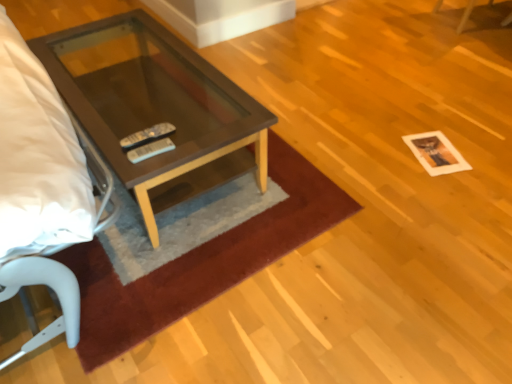
Measure the distance between point (234, 236) and camera.

The distance of point (234, 236) from camera is 1.70 meters.

What do you see at coordinates (436, 153) in the screenshot? This screenshot has height=384, width=512. I see `white paper at lower right` at bounding box center [436, 153].

Describe the element at coordinates (156, 108) in the screenshot. The width and height of the screenshot is (512, 384). I see `matte brown glass coffee table at center` at that location.

This screenshot has height=384, width=512. What are the coordinates of `brown plush rug at center` in the screenshot? It's located at [x=201, y=261].

Who is shorter, brown plush rug at center or matte brown glass coffee table at center?

With less height is brown plush rug at center.

From the picture: Could you tell me if brown plush rug at center is facing matte brown glass coffee table at center?

No.

From the image's perspective, which object appears higher, brown plush rug at center or matte brown glass coffee table at center?

matte brown glass coffee table at center, from the image's perspective.

Considering the relative sizes of brown plush rug at center and matte brown glass coffee table at center in the image provided, is brown plush rug at center bigger than matte brown glass coffee table at center?

No, brown plush rug at center is not bigger than matte brown glass coffee table at center.

Is brown plush rug at center located within white paper at lower right?

No, brown plush rug at center is not a part of white paper at lower right.

Are white paper at lower right and brown plush rug at center making contact?

No, white paper at lower right is not beside brown plush rug at center.

Does white paper at lower right have a greater width compared to brown plush rug at center?

No, white paper at lower right is not wider than brown plush rug at center.

Consider the image. Which of these two, white paper at lower right or brown plush rug at center, is smaller?

With smaller size is white paper at lower right.

Can you confirm if matte brown glass coffee table at center is taller than brown plush rug at center?

Yes.

Where is `mat in front of the matte brown glass coffee table at center`? This screenshot has height=384, width=512. mat in front of the matte brown glass coffee table at center is located at coordinates (201, 261).

Considering the points (165, 109) and (168, 311), which point is in front, point (165, 109) or point (168, 311)?

Point (168, 311)

Is matte brown glass coffee table at center inside or outside of white paper at lower right?

matte brown glass coffee table at center is not enclosed by white paper at lower right.

Consider the image. Does matte brown glass coffee table at center touch white paper at lower right?

No.

Is point (182, 105) positioned before point (452, 159)?

No, it is behind (452, 159).

From the image's perspective, is matte brown glass coffee table at center above white paper at lower right?

Yes, from the image's perspective, matte brown glass coffee table at center is on top of white paper at lower right.

Can you confirm if brown plush rug at center is shorter than white paper at lower right?

No, brown plush rug at center is not shorter than white paper at lower right.

Is brown plush rug at center positioned with its back to white paper at lower right?

brown plush rug at center does not have its back to white paper at lower right.

From the image's perspective, does brown plush rug at center appear higher than white paper at lower right?

Actually, brown plush rug at center appears below white paper at lower right in the image.

Considering the relative positions of brown plush rug at center and white paper at lower right in the image provided, is brown plush rug at center in front of white paper at lower right?

Yes, the depth of brown plush rug at center is less than that of white paper at lower right.

Is white paper at lower right taller than matte brown glass coffee table at center?

Incorrect, the height of white paper at lower right is not larger of that of matte brown glass coffee table at center.

Can you confirm if white paper at lower right is wider than matte brown glass coffee table at center?

In fact, white paper at lower right might be narrower than matte brown glass coffee table at center.

Which object is positioned more to the right, white paper at lower right or matte brown glass coffee table at center?

white paper at lower right.

From a real-world perspective, is white paper at lower right physically below matte brown glass coffee table at center?

Indeed, from a real-world perspective, white paper at lower right is positioned beneath matte brown glass coffee table at center.

This screenshot has width=512, height=384. I want to click on mat below the matte brown glass coffee table at center (from a real-world perspective), so click(201, 261).

The image size is (512, 384). In the image, there is a brown plush rug at center. In order to click on square above it (from the image's perspective) in this screenshot , I will do `click(436, 153)`.

Based on their spatial positions, is matte brown glass coffee table at center or white paper at lower right further from brown plush rug at center?

white paper at lower right.

Considering their positions, is matte brown glass coffee table at center positioned further to white paper at lower right than brown plush rug at center?

matte brown glass coffee table at center.

In the scene shown: Considering their positions, is brown plush rug at center positioned closer to matte brown glass coffee table at center than white paper at lower right?

brown plush rug at center is positioned closer to the anchor matte brown glass coffee table at center.

Based on their spatial positions, is brown plush rug at center or matte brown glass coffee table at center closer to white paper at lower right?

brown plush rug at center is closer to white paper at lower right.

Based on their spatial positions, is white paper at lower right or matte brown glass coffee table at center closer to brown plush rug at center?

Answer: matte brown glass coffee table at center.

From the image, which object appears to be nearer to matte brown glass coffee table at center, white paper at lower right or brown plush rug at center?

brown plush rug at center is positioned closer to the anchor matte brown glass coffee table at center.

In order to click on mat located between matte brown glass coffee table at center and white paper at lower right in the left-right direction in this screenshot , I will do `click(201, 261)`.